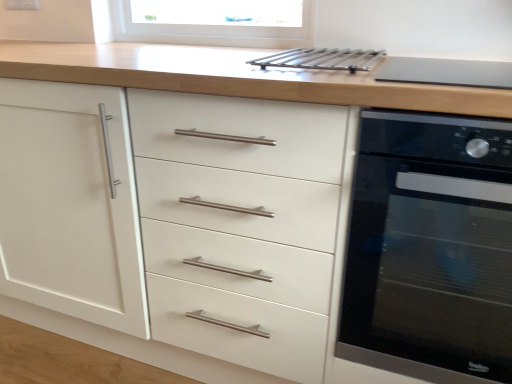
Question: Can you confirm if black glass oven at right is taller than matte black cooktop at upper right?

Choices:
 (A) no
 (B) yes

Answer: (B)

Question: Considering the relative positions of black glass oven at right and matte black cooktop at upper right in the image provided, is black glass oven at right behind matte black cooktop at upper right?

Choices:
 (A) yes
 (B) no

Answer: (B)

Question: Is black glass oven at right completely or partially outside of matte black cooktop at upper right?

Choices:
 (A) no
 (B) yes

Answer: (B)

Question: From a real-world perspective, is black glass oven at right positioned over matte black cooktop at upper right based on gravity?

Choices:
 (A) yes
 (B) no

Answer: (B)

Question: Does black glass oven at right have a larger size compared to matte black cooktop at upper right?

Choices:
 (A) no
 (B) yes

Answer: (B)

Question: From the image's perspective, is matte black cooktop at upper right positioned above or below black glass oven at right?

Choices:
 (A) above
 (B) below

Answer: (A)

Question: Is point (493, 69) positioned closer to the camera than point (360, 354)?

Choices:
 (A) farther
 (B) closer

Answer: (A)

Question: From a real-world perspective, is matte black cooktop at upper right physically located above or below black glass oven at right?

Choices:
 (A) above
 (B) below

Answer: (A)

Question: Based on their positions, is matte black cooktop at upper right located to the left or right of black glass oven at right?

Choices:
 (A) right
 (B) left

Answer: (B)

Question: In the image, is matte black cooktop at upper right on the left side or the right side of metallic silver rack at upper center?

Choices:
 (A) left
 (B) right

Answer: (B)

Question: From a real-world perspective, relative to metallic silver rack at upper center, is matte black cooktop at upper right vertically above or below?

Choices:
 (A) above
 (B) below

Answer: (B)

Question: From their relative heights in the image, would you say matte black cooktop at upper right is taller or shorter than metallic silver rack at upper center?

Choices:
 (A) short
 (B) tall

Answer: (B)

Question: Based on their sizes in the image, would you say matte black cooktop at upper right is bigger or smaller than metallic silver rack at upper center?

Choices:
 (A) big
 (B) small

Answer: (A)

Question: Considering the relative positions of metallic silver rack at upper center and black glass oven at right in the image provided, is metallic silver rack at upper center to the left or to the right of black glass oven at right?

Choices:
 (A) right
 (B) left

Answer: (B)

Question: Does point (302, 64) appear closer or farther from the camera than point (390, 286)?

Choices:
 (A) closer
 (B) farther

Answer: (A)